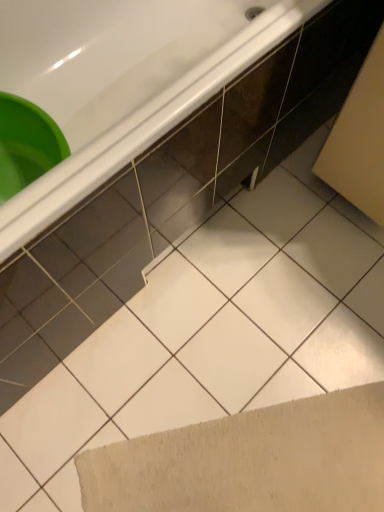
Where is `white glossy bathtub at upper left`? The image size is (384, 512). white glossy bathtub at upper left is located at coordinates (122, 82).

What do you see at coordinates (122, 82) in the screenshot? The height and width of the screenshot is (512, 384). I see `white glossy bathtub at upper left` at bounding box center [122, 82].

In order to face white glossy bathtub at upper left, should I rotate leftwards or rightwards?

A 7.637 degree turn to the left will do.

Where is `white glossy bathtub at upper left`? white glossy bathtub at upper left is located at coordinates (122, 82).